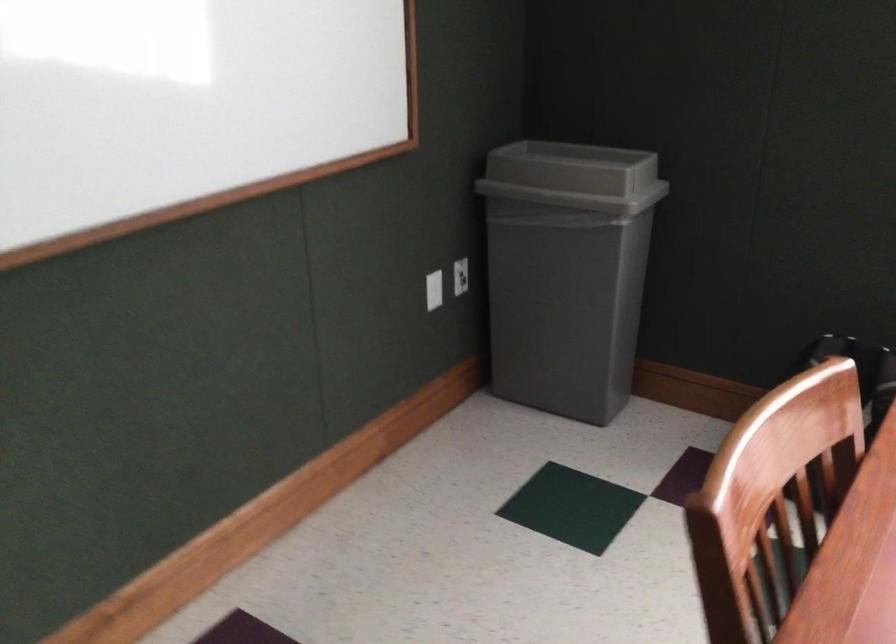
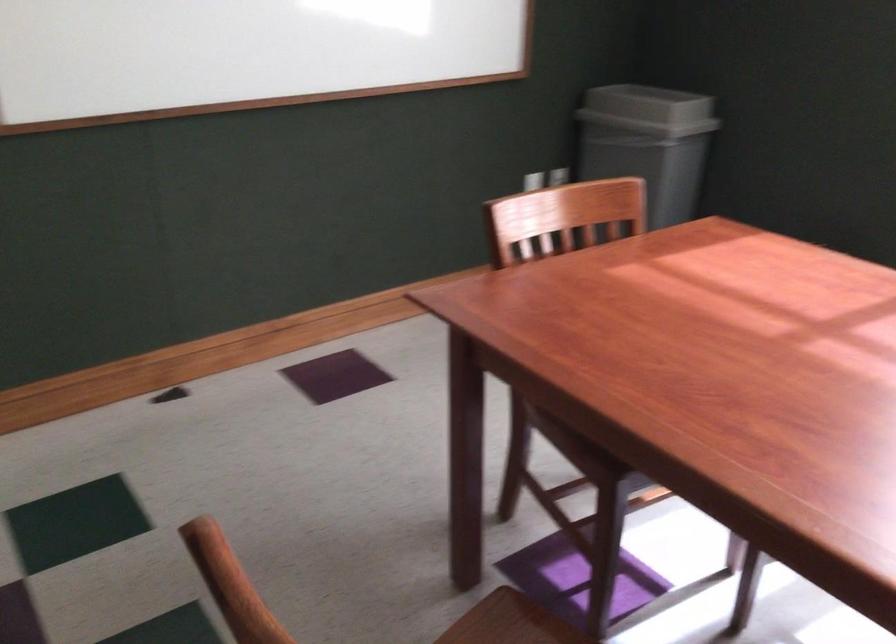
In a continuous first-person perspective shot, in which direction is the camera moving?

The movement direction of the cameraman is right, backward.